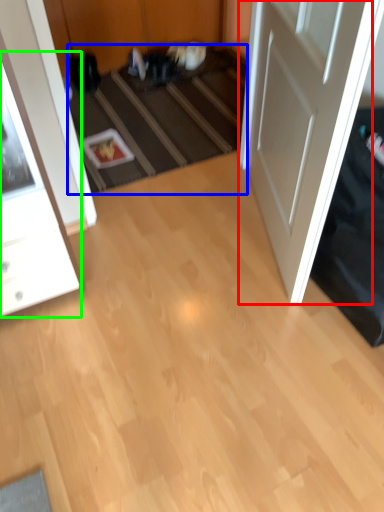
Question: Which is nearer to the door (highlighted by a red box)? stair (highlighted by a blue box) or cabinetry (highlighted by a green box).

Choices:
 (A) stair
 (B) cabinetry

Answer: (A)